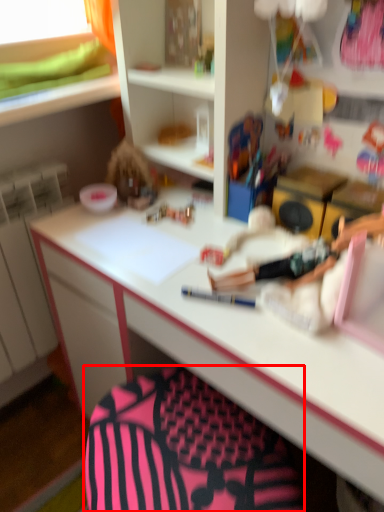
Question: Considering the relative positions of swivel chair (annotated by the red box) and stationery in the image provided, where is swivel chair (annotated by the red box) located with respect to the staircase?

Choices:
 (A) left
 (B) right

Answer: (B)